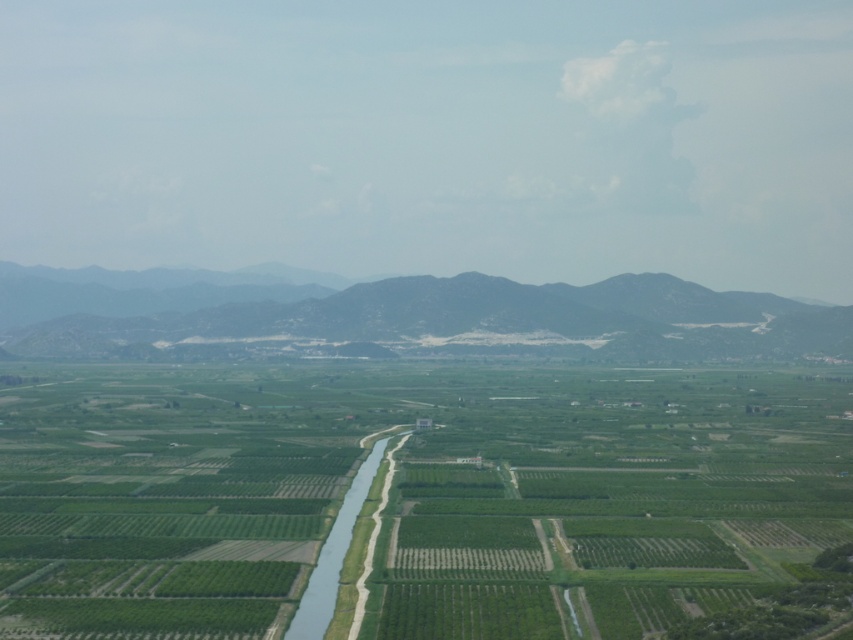
You are a farmer planning to install a fence along the edge of the green grassy waterway at center and the green textured mountain at center. Based on the scene, which of these two objects would require a longer fence to enclose its entire perimeter?

The green textured mountain at center might require a longer fence because it is wider than the green grassy waterway at center according to the description.

Based on the provided scene description, where is the green grassy fields at center located in terms of their 2D coordinates?

The green grassy fields at center are located at the 2D coordinates of point (412, 497).

You are a drone operator flying over the rural landscape. You need to determine the order of two points from your current position. Which point is closer to you, point at coordinates (65, 596) or point at (793, 356)?

Point at coordinates (65, 596) is in front of point at (793, 356), so it is closer to your current position.